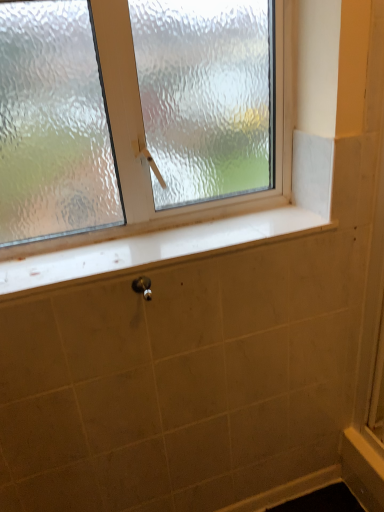
Locate an element on the screen. This screenshot has height=512, width=384. metallic silver shower at lower center is located at coordinates (143, 287).

At what (x,y) coordinates should I click in order to perform the action: click on white glossy window sill at center. Please return your answer as a coordinate pair (x, y). Looking at the image, I should click on (155, 248).

Is point (144, 289) farther from viewer compared to point (225, 215)?

No, it is not.

Which is in front, metallic silver shower at lower center or frosted glass window at upper center?

frosted glass window at upper center.

In the scene shown: Does metallic silver shower at lower center touch frosted glass window at upper center?

No, metallic silver shower at lower center is not in contact with frosted glass window at upper center.

Is white glossy window sill at center surrounded by frosted glass window at upper center?

That's incorrect, white glossy window sill at center is not inside frosted glass window at upper center.

From the picture: Is frosted glass window at upper center with white glossy window sill at center?

They are not placed beside each other.

I want to click on window sill behind the frosted glass window at upper center, so click(155, 248).

Is frosted glass window at upper center to the left or to the right of white glossy window sill at center in the image?

In the image, frosted glass window at upper center appears on the left side of white glossy window sill at center.

From a real-world perspective, relative to frosted glass window at upper center, is white glossy window sill at center vertically above or below?

white glossy window sill at center is below frosted glass window at upper center.

Is the depth of white glossy window sill at center greater than that of frosted glass window at upper center?

Yes, it is.

From the image's perspective, between white glossy window sill at center and frosted glass window at upper center, which one is located above?

frosted glass window at upper center appears higher in the image.

Are white glossy window sill at center and frosted glass window at upper center far apart?

Actually, white glossy window sill at center and frosted glass window at upper center are a little close together.

Is point (141, 284) positioned behind point (66, 273)?

Yes, it is behind point (66, 273).

Which of these two, metallic silver shower at lower center or white glossy window sill at center, stands shorter?

Standing shorter between the two is white glossy window sill at center.

Which is in front, metallic silver shower at lower center or white glossy window sill at center?

white glossy window sill at center is in front.

Considering the sizes of objects metallic silver shower at lower center and white glossy window sill at center in the image provided, who is smaller, metallic silver shower at lower center or white glossy window sill at center?

metallic silver shower at lower center.

Considering the sizes of objects white glossy window sill at center and metallic silver shower at lower center in the image provided, who is smaller, white glossy window sill at center or metallic silver shower at lower center?

metallic silver shower at lower center is smaller.

From the picture: Which object is thinner, white glossy window sill at center or metallic silver shower at lower center?

Thinner between the two is metallic silver shower at lower center.

Are white glossy window sill at center and metallic silver shower at lower center far apart?

No, white glossy window sill at center is in close proximity to metallic silver shower at lower center.

From the image's perspective, relative to metallic silver shower at lower center, is white glossy window sill at center above or below?

white glossy window sill at center is situated higher than metallic silver shower at lower center in the image.

Considering the sizes of objects frosted glass window at upper center and metallic silver shower at lower center in the image provided, who is bigger, frosted glass window at upper center or metallic silver shower at lower center?

With larger size is frosted glass window at upper center.

Is metallic silver shower at lower center completely or partially inside frosted glass window at upper center?

No, frosted glass window at upper center does not contain metallic silver shower at lower center.

Is frosted glass window at upper center to the right of metallic silver shower at lower center from the viewer's perspective?

Incorrect, frosted glass window at upper center is not on the right side of metallic silver shower at lower center.

Does frosted glass window at upper center touch metallic silver shower at lower center?

frosted glass window at upper center and metallic silver shower at lower center are clearly separated.

Find the location of a particular element. This screenshot has height=512, width=384. window in front of the metallic silver shower at lower center is located at coordinates (145, 137).

What are the coordinates of `window sill located underneath the frosted glass window at upper center (from a real-world perspective)` in the screenshot? It's located at [155, 248].

Considering their positions, is metallic silver shower at lower center positioned further to white glossy window sill at center than frosted glass window at upper center?

metallic silver shower at lower center is further to white glossy window sill at center.

Estimate the real-world distances between objects in this image. Which object is further from white glossy window sill at center, frosted glass window at upper center or metallic silver shower at lower center?

metallic silver shower at lower center.

From the image, which object appears to be farther from metallic silver shower at lower center, frosted glass window at upper center or white glossy window sill at center?

Among the two, frosted glass window at upper center is located further to metallic silver shower at lower center.

Looking at the image, which one is located further to frosted glass window at upper center, metallic silver shower at lower center or white glossy window sill at center?

metallic silver shower at lower center is further to frosted glass window at upper center.

From the image, which object appears to be nearer to metallic silver shower at lower center, white glossy window sill at center or frosted glass window at upper center?

white glossy window sill at center.

Based on their spatial positions, is white glossy window sill at center or metallic silver shower at lower center closer to frosted glass window at upper center?

white glossy window sill at center.

At what (x,y) coordinates should I click in order to perform the action: click on window sill between frosted glass window at upper center and metallic silver shower at lower center from top to bottom. Please return your answer as a coordinate pair (x, y). Looking at the image, I should click on (155, 248).